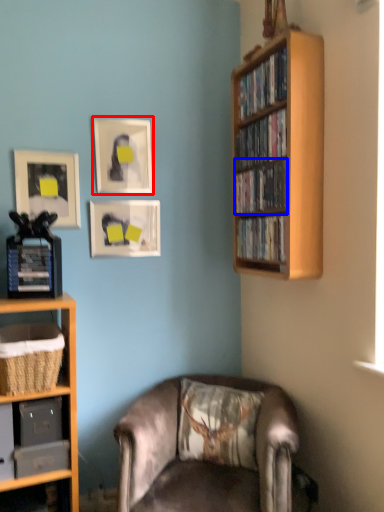
Question: Which point is further to the camera, picture frame (highlighted by a red box) or book (highlighted by a blue box)?

Choices:
 (A) picture frame
 (B) book

Answer: (A)